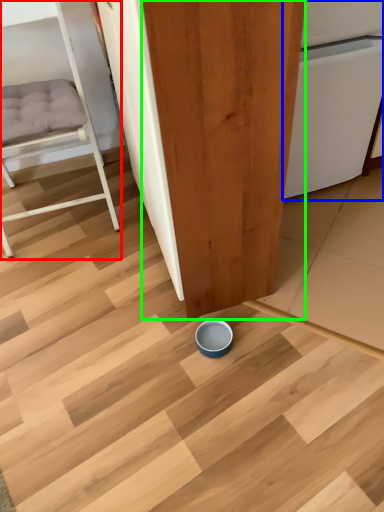
Question: Which object is positioned farthest from furniture (highlighted by a red box)? Select from dish washer (highlighted by a blue box) and plywood (highlighted by a green box).

Choices:
 (A) dish washer
 (B) plywood

Answer: (A)